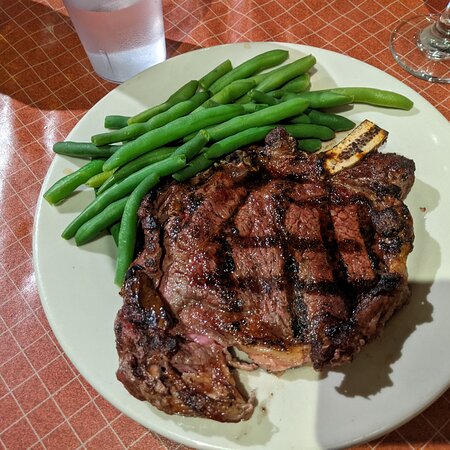
Find the location of a particular element. The image size is (450, 450). table cover is located at coordinates (369, 36).